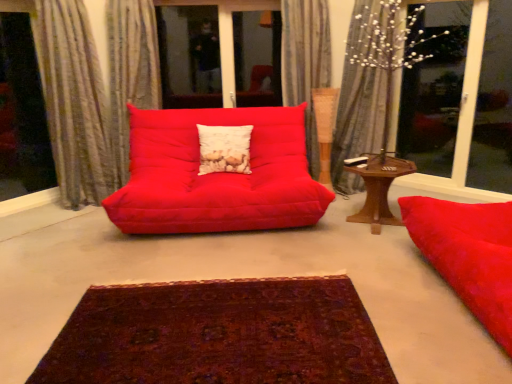
Locate an element on the screen. The height and width of the screenshot is (384, 512). vacant space that is in between textured grey curtain at left, placed as the 4th curtain when sorted from right to left, and deep burgundy woven rug at center is located at coordinates (145, 260).